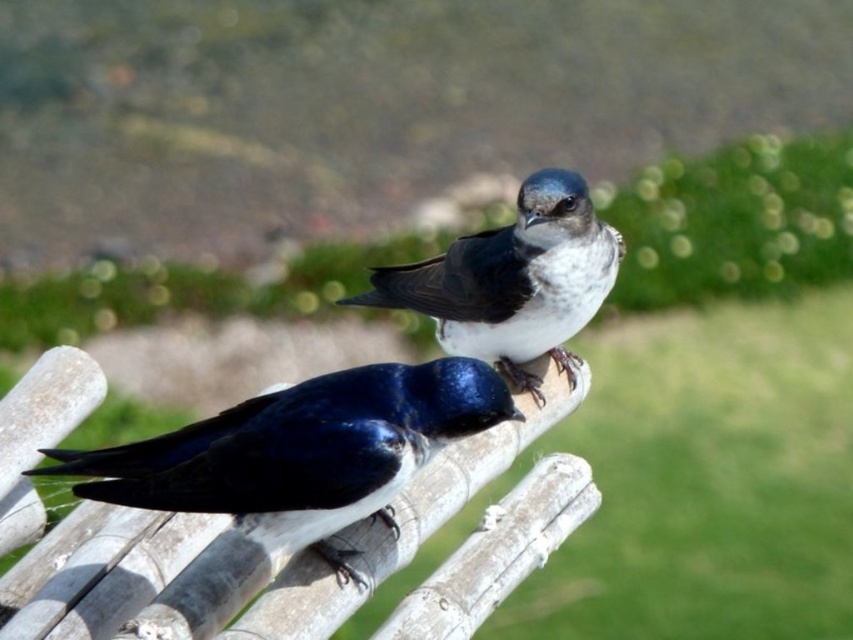
Question: Does shiny blue bird at center appear under white glossy bird at center?

Choices:
 (A) no
 (B) yes

Answer: (B)

Question: Which object is farther from the camera taking this photo?

Choices:
 (A) white glossy bird at center
 (B) shiny blue bird at center

Answer: (A)

Question: Is shiny blue bird at center above white glossy bird at center?

Choices:
 (A) yes
 (B) no

Answer: (B)

Question: Among these points, which one is nearest to the camera?

Choices:
 (A) (463, 388)
 (B) (514, 296)

Answer: (A)

Question: Among these objects, which one is nearest to the camera?

Choices:
 (A) white glossy bird at center
 (B) shiny blue bird at center

Answer: (B)

Question: Is shiny blue bird at center to the left of white glossy bird at center from the viewer's perspective?

Choices:
 (A) no
 (B) yes

Answer: (B)